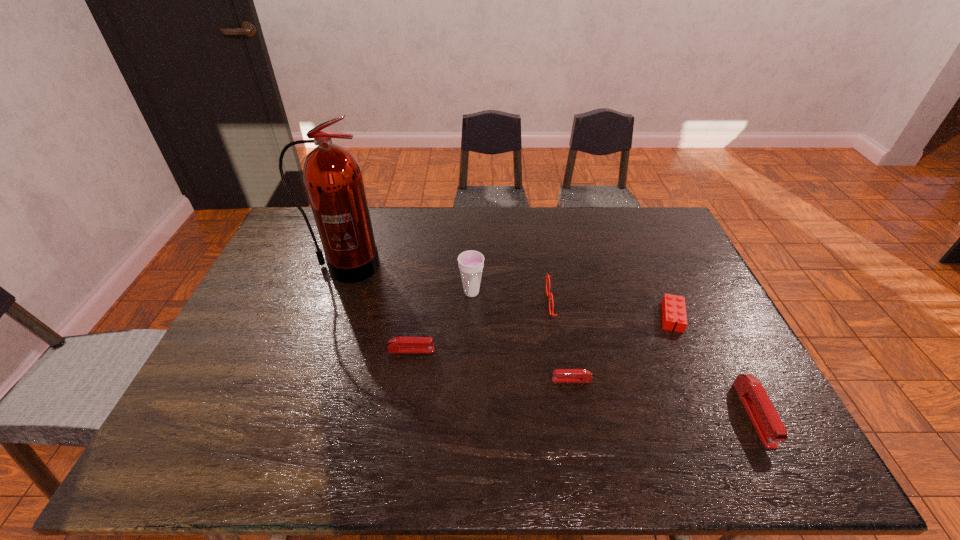
Image resolution: width=960 pixels, height=540 pixels. I want to click on the second tallest stapler, so click(x=398, y=344).

Find the location of a particular element. The width and height of the screenshot is (960, 540). the farthest stapler is located at coordinates click(x=398, y=344).

Where is `the second stapler from left to right`? Image resolution: width=960 pixels, height=540 pixels. the second stapler from left to right is located at coordinates (559, 375).

At what (x,y) coordinates should I click in order to perform the action: click on the tallest stapler. Please return your answer as a coordinate pair (x, y). The image size is (960, 540). Looking at the image, I should click on (769, 426).

This screenshot has height=540, width=960. Identify the location of the rightmost object. (769, 426).

The image size is (960, 540). I want to click on the second object from right to left, so click(x=673, y=307).

I want to click on the farthest object, so click(x=333, y=179).

Find the location of a particular element. the leftmost object is located at coordinates (333, 179).

At what (x,y) coordinates should I click in order to perform the action: click on the sixth shortest object. Please return your answer as a coordinate pair (x, y). This screenshot has height=540, width=960. Looking at the image, I should click on (471, 263).

Where is `cup`? The image size is (960, 540). cup is located at coordinates (471, 263).